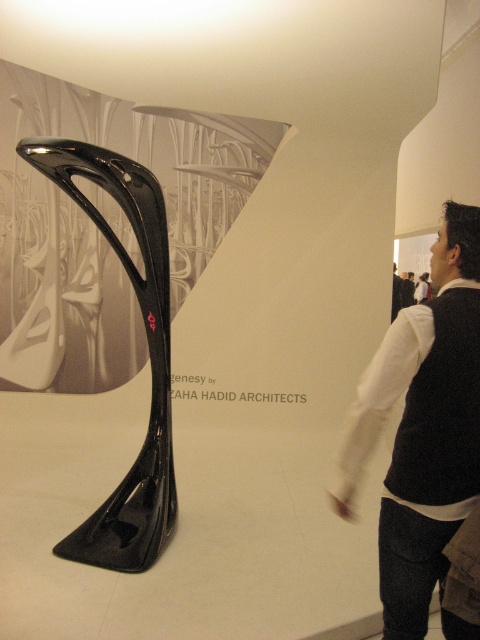
Question: Is black fabric vest at center bigger than glossy carbon fiber sculpture at center?

Choices:
 (A) no
 (B) yes

Answer: (A)

Question: Can you confirm if black fabric vest at center is positioned to the left of glossy carbon fiber sculpture at center?

Choices:
 (A) yes
 (B) no

Answer: (B)

Question: Among these objects, which one is farthest from the camera?

Choices:
 (A) glossy carbon fiber sculpture at center
 (B) black fabric vest at center

Answer: (A)

Question: Can you confirm if black fabric vest at center is positioned to the left of glossy carbon fiber sculpture at center?

Choices:
 (A) yes
 (B) no

Answer: (B)

Question: Among these points, which one is nearest to the camera?

Choices:
 (A) (156, 492)
 (B) (381, 500)

Answer: (B)

Question: Which point is closer to the camera?

Choices:
 (A) glossy carbon fiber sculpture at center
 (B) black fabric vest at center

Answer: (B)